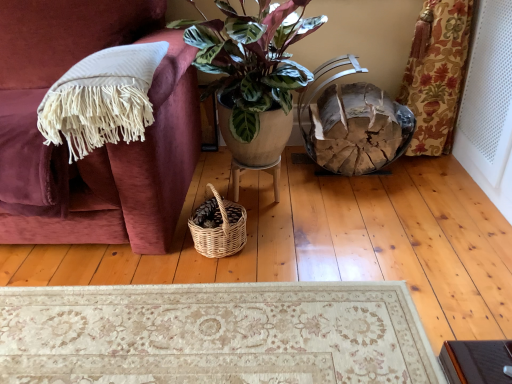
The image size is (512, 384). In order to click on white fringed blanket at left in this screenshot , I will do 102,99.

The image size is (512, 384). Describe the element at coordinates (102, 99) in the screenshot. I see `white fringed blanket at left` at that location.

Find the location of a particular element. The height and width of the screenshot is (384, 512). wooden stool at center is located at coordinates (256, 170).

Locate an element on the screen. The width and height of the screenshot is (512, 384). white perforated screen door at right is located at coordinates (489, 106).

The height and width of the screenshot is (384, 512). What do you see at coordinates (353, 123) in the screenshot? I see `wooden textured basket at lower right` at bounding box center [353, 123].

Image resolution: width=512 pixels, height=384 pixels. In order to click on woven natural picnic basket at lower center in this screenshot , I will do `click(221, 229)`.

Which of these two, woven natural picnic basket at lower center or wooden textured basket at lower right, stands shorter?

With less height is woven natural picnic basket at lower center.

Which is further, (x=217, y=192) or (x=348, y=150)?

The point (x=348, y=150) is behind.

From a real-world perspective, who is located higher, woven natural picnic basket at lower center or wooden textured basket at lower right?

wooden textured basket at lower right.

Which object is wider, woven natural picnic basket at lower center or wooden textured basket at lower right?

wooden textured basket at lower right.

Which of these two, white fringed blanket at left or woven natural picnic basket at lower center, stands shorter?

woven natural picnic basket at lower center is shorter.

Is white fringed blanket at left surrounding woven natural picnic basket at lower center?

No.

Considering the positions of point (129, 97) and point (237, 226), is point (129, 97) closer or farther from the camera than point (237, 226)?

Clearly, point (129, 97) is closer to the camera than point (237, 226).

From a real-world perspective, which is physically below, white fringed blanket at left or woven natural picnic basket at lower center?

woven natural picnic basket at lower center.

From the image's perspective, is woven natural picnic basket at lower center on white fringed blanket at left?

No, from the image's perspective, woven natural picnic basket at lower center is not over white fringed blanket at left.

Can you confirm if woven natural picnic basket at lower center is thinner than white fringed blanket at left?

Yes.

Measure the distance from woven natural picnic basket at lower center to white fringed blanket at left.

woven natural picnic basket at lower center is 50.18 centimeters away from white fringed blanket at left.

In the scene shown: Can you confirm if woven natural picnic basket at lower center is taller than white fringed blanket at left?

In fact, woven natural picnic basket at lower center may be shorter than white fringed blanket at left.

The height and width of the screenshot is (384, 512). Find the location of `table on the right of white fringed blanket at left`. table on the right of white fringed blanket at left is located at coordinates (256, 170).

Is point (100, 117) positioned in front of point (237, 162)?

Yes.

From the image's perspective, is white fringed blanket at left positioned above or below wooden stool at center?

white fringed blanket at left is situated higher than wooden stool at center in the image.

What's the angular difference between white fringed blanket at left and wooden stool at center's facing directions?

1.13 degrees separate the facing orientations of white fringed blanket at left and wooden stool at center.

Which object is further away from the camera, wooden textured basket at lower right or wooden stool at center?

wooden textured basket at lower right is further away from the camera.

From a real-world perspective, is wooden textured basket at lower right positioned under wooden stool at center based on gravity?

Incorrect, from a real-world perspective, wooden textured basket at lower right is higher than wooden stool at center.

How much distance is there between wooden textured basket at lower right and wooden stool at center?

wooden textured basket at lower right and wooden stool at center are 15.98 inches apart from each other.

Which object is positioned more to the left, wooden textured basket at lower right or wooden stool at center?

wooden stool at center.

Measure the distance between green glossy plant pot at center and white fringed blanket at left.

45.48 centimeters.

In the image, is green glossy plant pot at center on the left side or the right side of white fringed blanket at left?

Based on their positions, green glossy plant pot at center is located to the right of white fringed blanket at left.

Identify the location of blanket above the green glossy plant pot at center (from a real-world perspective). The width and height of the screenshot is (512, 384). (102, 99).

Between green glossy plant pot at center and white fringed blanket at left, which one has smaller width?

With smaller width is white fringed blanket at left.

From the image's perspective, is wooden stool at center above white fringed blanket at left?

No, from the image's perspective, wooden stool at center is not on top of white fringed blanket at left.

Which is more to the left, wooden stool at center or white fringed blanket at left?

Positioned to the left is white fringed blanket at left.

Locate an element on the screen. blanket above the wooden stool at center (from the image's perspective) is located at coordinates (102, 99).

This screenshot has height=384, width=512. In order to click on rocking chair above the woven natural picnic basket at lower center (from a real-world perspective) in this screenshot , I will do `click(353, 123)`.

In the image, there is a white fringed blanket at left. Identify the location of picnic basket below it (from a real-world perspective). The image size is (512, 384). (221, 229).

Which object lies nearer to the anchor point woven natural picnic basket at lower center, white perforated screen door at right or white fringed blanket at left?

The object closer to woven natural picnic basket at lower center is white fringed blanket at left.

When comparing their distances from white perforated screen door at right, does wooden textured basket at lower right or white fringed blanket at left seem closer?

Among the two, wooden textured basket at lower right is located nearer to white perforated screen door at right.

Estimate the real-world distances between objects in this image. Which object is further from green glossy plant pot at center, woven natural picnic basket at lower center or white perforated screen door at right?

The object further to green glossy plant pot at center is white perforated screen door at right.

When comparing their distances from woven natural picnic basket at lower center, does green glossy plant pot at center or wooden textured basket at lower right seem further?

wooden textured basket at lower right is positioned further to the anchor woven natural picnic basket at lower center.

Which object lies further to the anchor point white fringed blanket at left, white perforated screen door at right or wooden stool at center?

The object further to white fringed blanket at left is white perforated screen door at right.

Consider the image. When comparing their distances from green glossy plant pot at center, does white fringed blanket at left or wooden textured basket at lower right seem further?

white fringed blanket at left lies further to green glossy plant pot at center than the other object.

Looking at the image, which one is located further to green glossy plant pot at center, white perforated screen door at right or wooden stool at center?

white perforated screen door at right is further to green glossy plant pot at center.

Which object lies nearer to the anchor point white perforated screen door at right, woven natural picnic basket at lower center or green glossy plant pot at center?

green glossy plant pot at center.

The image size is (512, 384). Find the location of `rocking chair situated between wooden stool at center and white perforated screen door at right from left to right`. rocking chair situated between wooden stool at center and white perforated screen door at right from left to right is located at coordinates (353, 123).

Where is `table positioned between green glossy plant pot at center and wooden textured basket at lower right from near to far`? table positioned between green glossy plant pot at center and wooden textured basket at lower right from near to far is located at coordinates (256, 170).

In order to click on table between white fringed blanket at left and white perforated screen door at right in this screenshot , I will do `click(256, 170)`.

Find the location of a particular element. The image size is (512, 384). picnic basket between white fringed blanket at left and wooden textured basket at lower right is located at coordinates (221, 229).